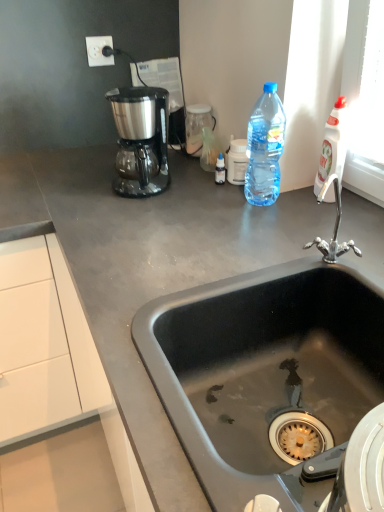
The width and height of the screenshot is (384, 512). What do you see at coordinates (141, 140) in the screenshot?
I see `satin black coffee maker at upper left` at bounding box center [141, 140].

What do you see at coordinates (274, 383) in the screenshot?
I see `black matte sink at center` at bounding box center [274, 383].

What do you see at coordinates (151, 268) in the screenshot?
I see `gray matte countertop at center` at bounding box center [151, 268].

What do you see at coordinates (265, 148) in the screenshot? I see `translucent plastic bottle at upper right, the 1th bottle in the left-to-right sequence` at bounding box center [265, 148].

The height and width of the screenshot is (512, 384). I want to click on satin black coffee maker at upper left, so coord(141,140).

Can you tell me how much black matte sink at center and satin black coffee maker at upper left differ in facing direction?

black matte sink at center and satin black coffee maker at upper left are facing 27.9 degrees away from each other.

What are the coordinates of `sink in front of the satin black coffee maker at upper left` in the screenshot? It's located at (274, 383).

From a real-world perspective, is black matte sink at center over satin black coffee maker at upper left?

No.

Considering the sizes of objects black matte sink at center and satin black coffee maker at upper left in the image provided, who is shorter, black matte sink at center or satin black coffee maker at upper left?

satin black coffee maker at upper left.

Considering the sizes of objects satin black coffee maker at upper left and white plastic electric outlet at upper left in the image provided, who is smaller, satin black coffee maker at upper left or white plastic electric outlet at upper left?

white plastic electric outlet at upper left is smaller.

Considering the positions of objects satin black coffee maker at upper left and white plastic electric outlet at upper left in the image provided, who is behind, satin black coffee maker at upper left or white plastic electric outlet at upper left?

white plastic electric outlet at upper left is more distant.

Which object is wider, satin black coffee maker at upper left or white plastic electric outlet at upper left?

satin black coffee maker at upper left.

Can you confirm if satin black coffee maker at upper left is positioned to the left of white plastic electric outlet at upper left?

In fact, satin black coffee maker at upper left is to the right of white plastic electric outlet at upper left.

Which object is positioned more to the right, white plastic electric outlet at upper left or translucent plastic bottle at upper right, the 1th bottle in the left-to-right sequence?

From the viewer's perspective, translucent plastic bottle at upper right, the 1th bottle in the left-to-right sequence, appears more on the right side.

Who is shorter, white plastic electric outlet at upper left or translucent plastic bottle at upper right, the 2th bottle from the right?

white plastic electric outlet at upper left.

From a real-world perspective, between white plastic electric outlet at upper left and translucent plastic bottle at upper right, the 2th bottle from the right, who is vertically lower?

translucent plastic bottle at upper right, the 2th bottle from the right, is physically lower.

From the image's perspective, count 1st bottles upward from the black matte sink at center and point to it. Please provide its 2D coordinates.

[(333, 146)]

Is black matte sink at center not near white plastic bottle at upper right, the 1th bottle when ordered from right to left?

They are positioned close to each other.

Is point (318, 450) closer to camera compared to point (329, 119)?

That is True.

From the image's perspective, is black matte sink at center positioned above or below white plastic bottle at upper right, the 1th bottle when ordered from right to left?

black matte sink at center is situated lower than white plastic bottle at upper right, the 1th bottle when ordered from right to left, in the image.

This screenshot has width=384, height=512. Find the location of `countertop below the satin black coffee maker at upper left (from a real-world perspective)`. countertop below the satin black coffee maker at upper left (from a real-world perspective) is located at coordinates (151, 268).

In the scene shown: How many degrees apart are the facing directions of gray matte countertop at center and satin black coffee maker at upper left?

The facing directions of gray matte countertop at center and satin black coffee maker at upper left are 62 degrees apart.

From a real-world perspective, is gray matte countertop at center below satin black coffee maker at upper left?

Yes, from a real-world perspective, gray matte countertop at center is below satin black coffee maker at upper left.

Which object is wider, gray matte countertop at center or satin black coffee maker at upper left?

gray matte countertop at center is wider.

From the image's perspective, is white plastic electric outlet at upper left above or below gray matte countertop at center?

Clearly, from the image's perspective, white plastic electric outlet at upper left is above gray matte countertop at center.

From a real-world perspective, which is physically below, white plastic electric outlet at upper left or gray matte countertop at center?

gray matte countertop at center.

Considering the relative positions of white plastic electric outlet at upper left and gray matte countertop at center in the image provided, is white plastic electric outlet at upper left to the left or to the right of gray matte countertop at center?

Based on their positions, white plastic electric outlet at upper left is located to the right of gray matte countertop at center.

Which is more to the left, black matte sink at center or white plastic electric outlet at upper left?

From the viewer's perspective, white plastic electric outlet at upper left appears more on the left side.

Can we say black matte sink at center lies outside white plastic electric outlet at upper left?

Yes, black matte sink at center is located beyond the bounds of white plastic electric outlet at upper left.

Is black matte sink at center positioned with its back to white plastic electric outlet at upper left?

No, black matte sink at center is not facing the opposite direction of white plastic electric outlet at upper left.

Which object is closer to the camera taking this photo, black matte sink at center or white plastic electric outlet at upper left?

black matte sink at center is in front.

You are a GUI agent. You are given a task and a screenshot of the screen. Output one action in this format:
    pyautogui.click(x=<x>, y=<y>)
    Task: Click on the sink below the satin black coffee maker at upper left (from a real-world perspective)
    The image size is (384, 512).
    Given the screenshot: What is the action you would take?
    pyautogui.click(x=274, y=383)

You are a GUI agent. You are given a task and a screenshot of the screen. Output one action in this format:
    pyautogui.click(x=<x>, y=<y>)
    Task: Click on the coffee maker in front of the white plastic electric outlet at upper left
    This screenshot has width=384, height=512.
    Given the screenshot: What is the action you would take?
    pyautogui.click(x=141, y=140)

Considering their positions, is black matte sink at center positioned closer to white plastic bottle at upper right, the 2th bottle from the left, than satin black coffee maker at upper left?

satin black coffee maker at upper left.

Estimate the real-world distances between objects in this image. Which object is further from white plastic bottle at upper right, the 2th bottle from the left, black matte sink at center or gray matte countertop at center?

black matte sink at center.

Based on their spatial positions, is white plastic electric outlet at upper left or black matte sink at center further from gray matte countertop at center?

Based on the image, white plastic electric outlet at upper left appears to be further to gray matte countertop at center.

Which object lies further to the anchor point white plastic electric outlet at upper left, translucent plastic bottle at upper right, the 2th bottle from the right, or white plastic bottle at upper right, the 1th bottle when ordered from right to left?

white plastic bottle at upper right, the 1th bottle when ordered from right to left, is further to white plastic electric outlet at upper left.

Considering their positions, is gray matte countertop at center positioned closer to translucent plastic bottle at upper right, the 1th bottle in the left-to-right sequence, than satin black coffee maker at upper left?

The object closer to translucent plastic bottle at upper right, the 1th bottle in the left-to-right sequence, is gray matte countertop at center.

From the image, which object appears to be nearer to gray matte countertop at center, satin black coffee maker at upper left or translucent plastic bottle at upper right, the 1th bottle in the left-to-right sequence?

Based on the image, satin black coffee maker at upper left appears to be nearer to gray matte countertop at center.

Based on their spatial positions, is white plastic bottle at upper right, the 1th bottle when ordered from right to left, or translucent plastic bottle at upper right, the 1th bottle in the left-to-right sequence, further from black matte sink at center?

white plastic bottle at upper right, the 1th bottle when ordered from right to left, lies further to black matte sink at center than the other object.

Looking at the image, which one is located further to gray matte countertop at center, white plastic bottle at upper right, the 2th bottle from the left, or white plastic electric outlet at upper left?

white plastic electric outlet at upper left is further to gray matte countertop at center.

Locate an element on the screen. bottle between gray matte countertop at center and white plastic bottle at upper right, the 1th bottle when ordered from right to left, from left to right is located at coordinates (265, 148).

This screenshot has height=512, width=384. Find the location of `countertop between white plastic electric outlet at upper left and black matte sink at center in the up-down direction`. countertop between white plastic electric outlet at upper left and black matte sink at center in the up-down direction is located at coordinates (151, 268).

Find the location of a particular element. Image resolution: width=384 pixels, height=512 pixels. coffee maker located between white plastic electric outlet at upper left and white plastic bottle at upper right, the 1th bottle when ordered from right to left, in the left-right direction is located at coordinates (141, 140).

Where is `electric outlet between gray matte countertop at center and white plastic bottle at upper right, the 1th bottle when ordered from right to left`? electric outlet between gray matte countertop at center and white plastic bottle at upper right, the 1th bottle when ordered from right to left is located at coordinates (99, 50).